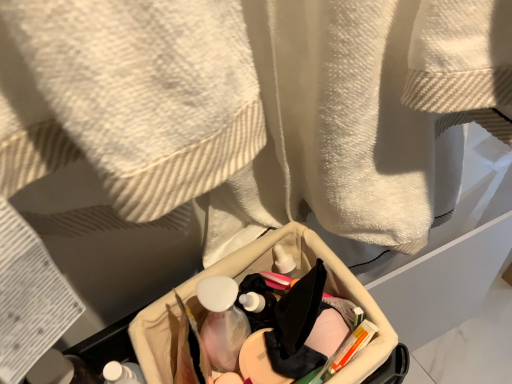
Question: Is translucent plastic mouthwash at center wider or thinner than beige fabric basket at center?

Choices:
 (A) wide
 (B) thin

Answer: (B)

Question: From the image's perspective, relative to beige fabric basket at center, is translucent plastic mouthwash at center above or below?

Choices:
 (A) above
 (B) below

Answer: (A)

Question: Estimate the real-world distances between objects in this image. Which object is farther from the beige fabric basket at center?

Choices:
 (A) white matte bottle at lower left
 (B) translucent plastic mouthwash at center

Answer: (A)

Question: Estimate the real-world distances between objects in this image. Which object is farther from the white matte bottle at lower left?

Choices:
 (A) beige fabric basket at center
 (B) translucent plastic mouthwash at center

Answer: (A)